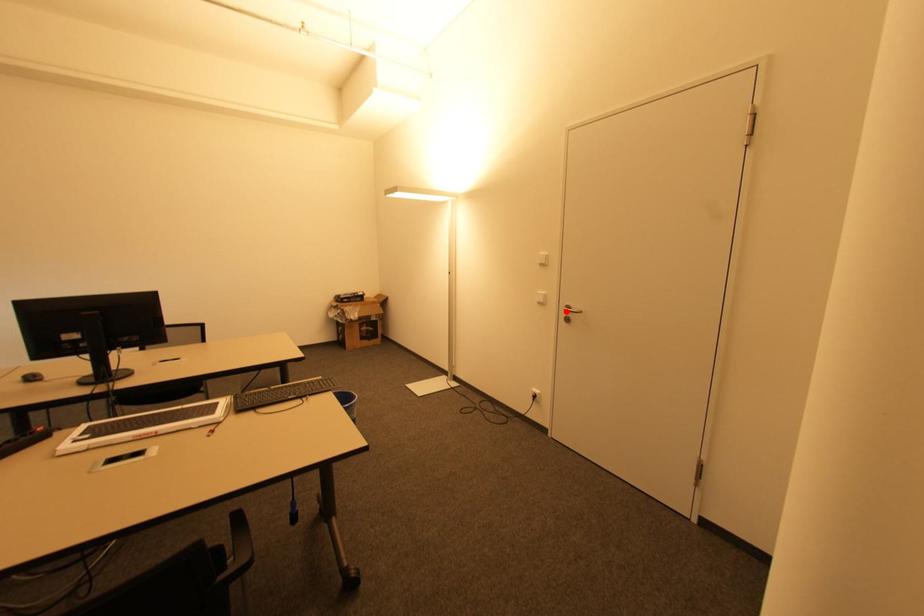
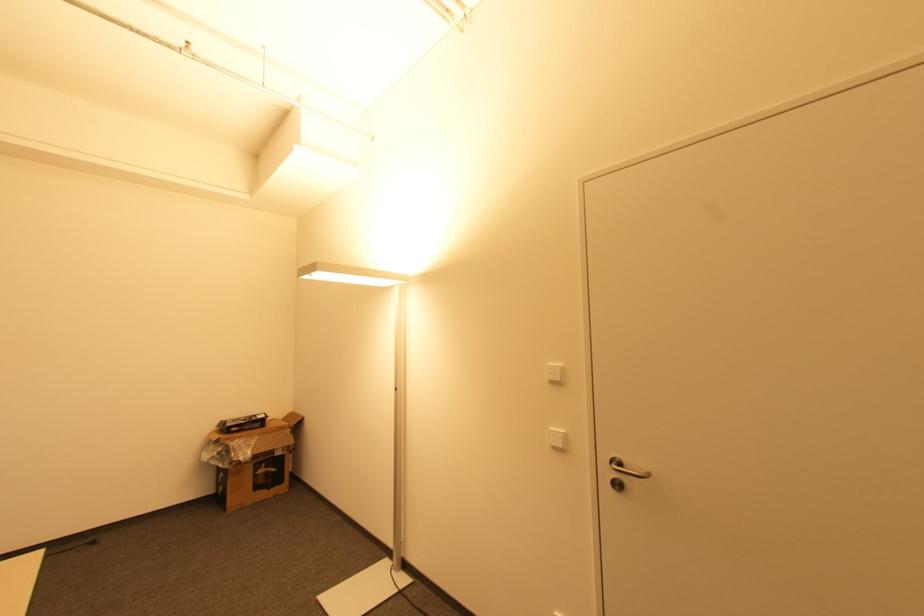
Question: I am providing you with two images of the same scene from different viewpoints. Given a red point in image1, look at the same physical point in image2. Is it:

Choices:
 (A) Closer to the viewpoint
 (B) Farther from the viewpoint

Answer: (B)